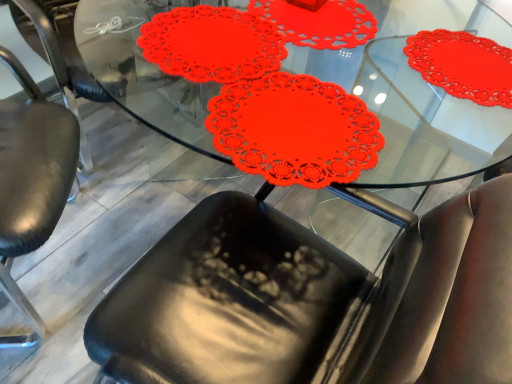
Question: In the image, is red paper doily at center on the left side or the right side of black leather chair at lower left?

Choices:
 (A) left
 (B) right

Answer: (B)

Question: In terms of height, does red paper doily at center look taller or shorter compared to black leather chair at lower left?

Choices:
 (A) short
 (B) tall

Answer: (A)

Question: From a real-world perspective, is red paper doily at center physically located above or below black leather chair at lower left?

Choices:
 (A) below
 (B) above

Answer: (B)

Question: In terms of size, does black leather chair at lower left appear bigger or smaller than red paper doily at center?

Choices:
 (A) big
 (B) small

Answer: (B)

Question: In terms of width, does black leather chair at lower left look wider or thinner when compared to red paper doily at center?

Choices:
 (A) thin
 (B) wide

Answer: (A)

Question: Which is correct: black leather chair at lower left is inside red paper doily at center, or outside of it?

Choices:
 (A) inside
 (B) outside

Answer: (B)

Question: Is black leather chair at lower left taller or shorter than red paper doily at center?

Choices:
 (A) tall
 (B) short

Answer: (A)